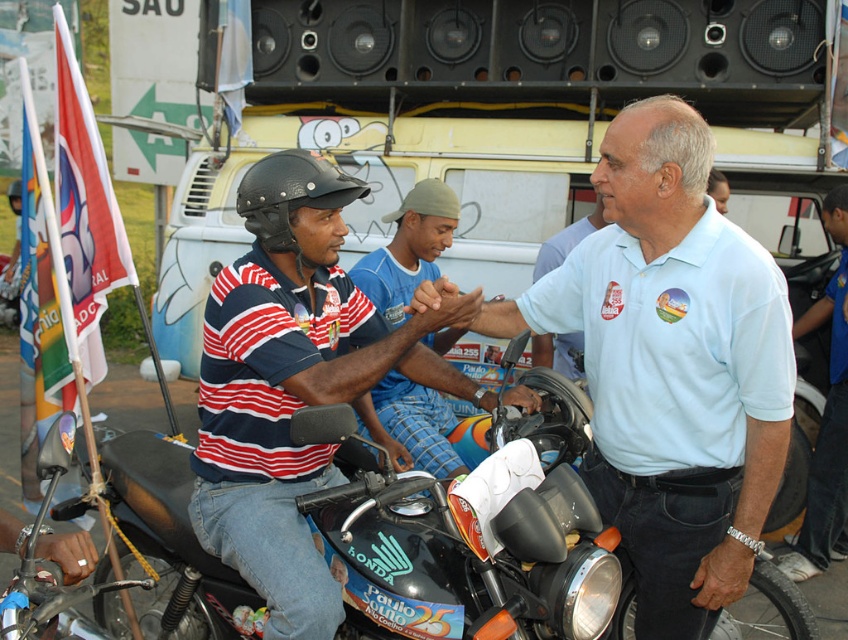
Question: Can you confirm if white cotton shirt at center is smaller than light blue polo shirt at center?

Choices:
 (A) yes
 (B) no

Answer: (B)

Question: Is black glossy motorcycle at center wider than white cotton shirt at center?

Choices:
 (A) yes
 (B) no

Answer: (A)

Question: Which object appears farthest from the camera in this image?

Choices:
 (A) white cotton shirt at center
 (B) black glossy motorcycle at center

Answer: (A)

Question: Among these points, which one is nearest to the camera?

Choices:
 (A) tap(294, 259)
 (B) tap(107, 611)
 (C) tap(489, 314)

Answer: (A)

Question: In this image, where is light blue shirt at center located relative to black matte helmet at center?

Choices:
 (A) above
 (B) below

Answer: (B)

Question: Based on their relative distances, which object is nearer to the light blue polo shirt at center?

Choices:
 (A) white cotton shirt at center
 (B) light blue shirt at center
 (C) black matte helmet at center

Answer: (A)